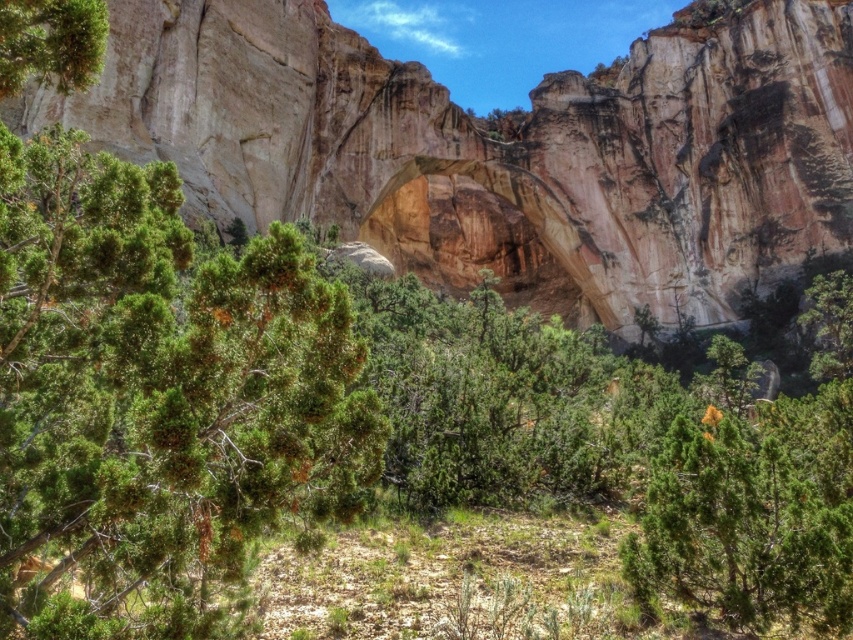
Question: Considering the relative positions of green matte tree at center and green textured pine tree at upper left in the image provided, where is green matte tree at center located with respect to green textured pine tree at upper left?

Choices:
 (A) above
 (B) below

Answer: (B)

Question: Which is nearer to the green textured pine tree at upper left?

Choices:
 (A) green matte tree at center
 (B) rustic sandstone arch at center
 (C) green needle-like at center

Answer: (C)

Question: Does rustic sandstone arch at center appear on the right side of green matte tree at center?

Choices:
 (A) yes
 (B) no

Answer: (B)

Question: Among these objects, which one is nearest to the camera?

Choices:
 (A) green needle-like at center
 (B) green matte tree at center

Answer: (A)

Question: Considering the real-world distances, which object is farthest from the green textured pine tree at upper left?

Choices:
 (A) green matte tree at center
 (B) rustic sandstone arch at center

Answer: (B)

Question: Is green matte tree at center to the right of green textured pine tree at upper left from the viewer's perspective?

Choices:
 (A) no
 (B) yes

Answer: (B)